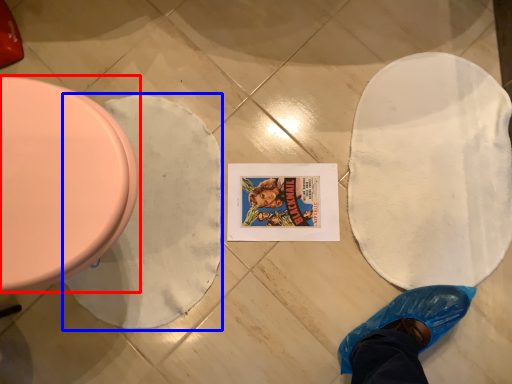
Question: Among these objects, which one is nearest to the camera, toilet (highlighted by a red box) or blanket (highlighted by a blue box)?

Choices:
 (A) toilet
 (B) blanket

Answer: (A)